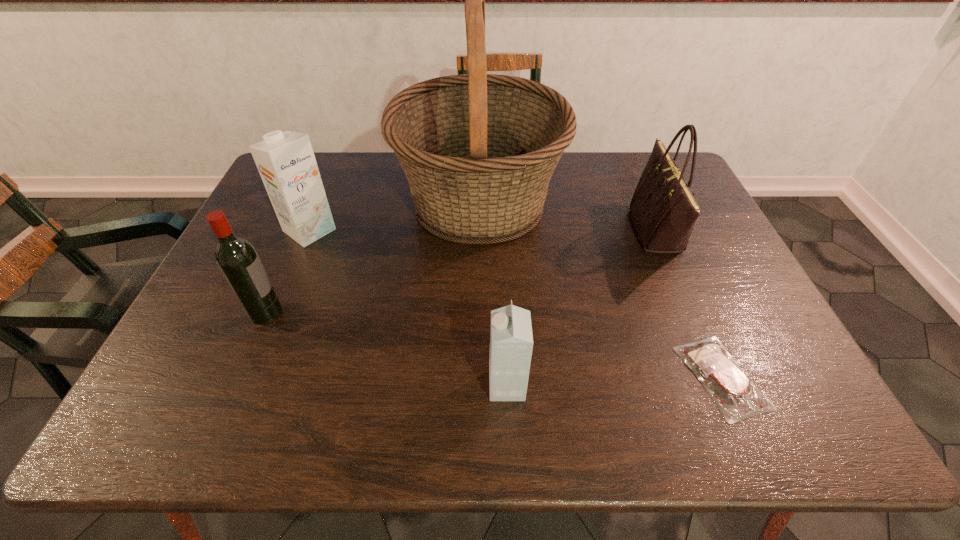
Locate an element on the screen. Image resolution: width=960 pixels, height=540 pixels. free space located on the front-facing side of the handbag is located at coordinates (505, 230).

The image size is (960, 540). What are the coordinates of `free location located 0.220m on the front-facing side of the handbag` in the screenshot? It's located at (557, 230).

This screenshot has height=540, width=960. I want to click on vacant space situated on the front of the left carton, so click(275, 315).

Where is `vacant space located on the label of the fourth farthest object`? vacant space located on the label of the fourth farthest object is located at coordinates (348, 312).

Locate an element on the screen. The height and width of the screenshot is (540, 960). free space located on the front label of the shorter carton is located at coordinates pyautogui.click(x=403, y=386).

You are a GUI agent. You are given a task and a screenshot of the screen. Output one action in this format:
    pyautogui.click(x=<x>, y=<y>)
    Task: Click on the vacant space located on the front label of the shorter carton
    
    Given the screenshot: What is the action you would take?
    pyautogui.click(x=302, y=386)

This screenshot has width=960, height=540. I want to click on vacant space located 0.100m on the front label of the shorter carton, so click(x=442, y=386).

Find the location of a particular element. free space located on the back of the steak is located at coordinates (661, 239).

In order to click on object that is at the far edge in this screenshot , I will do `click(478, 150)`.

What are the coordinates of `carton that is positioned at the near edge` in the screenshot? It's located at (511, 340).